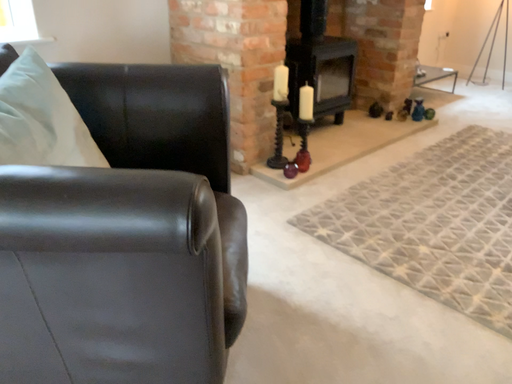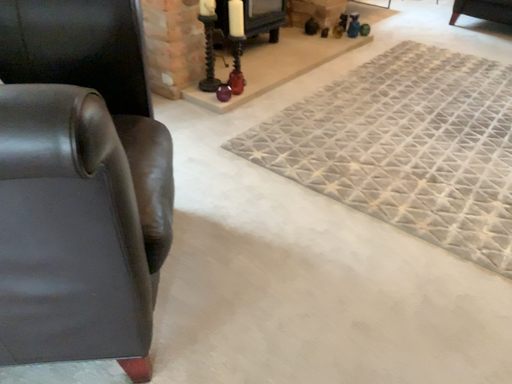
Question: How did the camera likely rotate when shooting the video?

Choices:
 (A) rotated right
 (B) rotated left

Answer: (A)